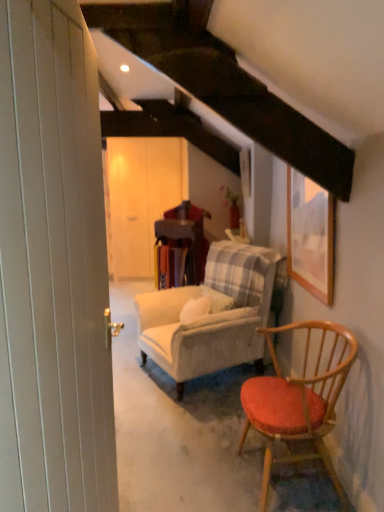
Question: Considering the relative sizes of white wood door at center, the 2th barn door viewed from the front, and white wooden barn door at left, arranged as the 1th barn door when viewed from the front, in the image provided, is white wood door at center, the 2th barn door viewed from the front, wider than white wooden barn door at left, arranged as the 1th barn door when viewed from the front,?

Choices:
 (A) yes
 (B) no

Answer: (A)

Question: Does white wood door at center, the 2th barn door viewed from the front, have a smaller size compared to white wooden barn door at left, arranged as the 1th barn door when viewed from the front?

Choices:
 (A) yes
 (B) no

Answer: (B)

Question: Is white wood door at center, the first barn door from the back, taller than white wooden barn door at left, arranged as the 1th barn door when viewed from the front?

Choices:
 (A) no
 (B) yes

Answer: (B)

Question: From the image's perspective, does white wood door at center, the 2th barn door viewed from the front, appear higher than white wooden barn door at left, the 2th barn door positioned from the back?

Choices:
 (A) no
 (B) yes

Answer: (B)

Question: Does white wood door at center, the 2th barn door viewed from the front, contain white wooden barn door at left, the 2th barn door positioned from the back?

Choices:
 (A) no
 (B) yes

Answer: (A)

Question: From a real-world perspective, is white wood door at center, the 2th barn door viewed from the front, below white wooden barn door at left, the 2th barn door positioned from the back?

Choices:
 (A) no
 (B) yes

Answer: (B)

Question: Is velvet beige armchair at center closer to camera compared to wooden framed picture at upper right?

Choices:
 (A) no
 (B) yes

Answer: (A)

Question: From the image's perspective, does velvet beige armchair at center appear lower than wooden framed picture at upper right?

Choices:
 (A) yes
 (B) no

Answer: (A)

Question: Does velvet beige armchair at center have a lesser width compared to wooden framed picture at upper right?

Choices:
 (A) yes
 (B) no

Answer: (B)

Question: Are velvet beige armchair at center and wooden framed picture at upper right located far from each other?

Choices:
 (A) no
 (B) yes

Answer: (A)

Question: Is wooden framed picture at upper right surrounded by velvet beige armchair at center?

Choices:
 (A) yes
 (B) no

Answer: (B)

Question: From the image's perspective, is velvet beige armchair at center located above wooden framed picture at upper right?

Choices:
 (A) yes
 (B) no

Answer: (B)

Question: From a real-world perspective, is wooden table at center located higher than wooden framed picture at upper right?

Choices:
 (A) no
 (B) yes

Answer: (A)